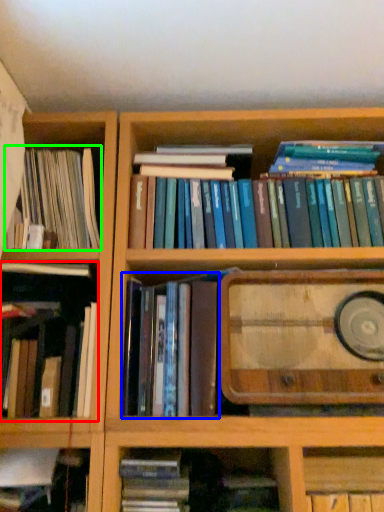
Question: Which object is the farthest from book (highlighted by a red box)? Choose among these: book (highlighted by a blue box) or book (highlighted by a green box).

Choices:
 (A) book
 (B) book

Answer: (B)